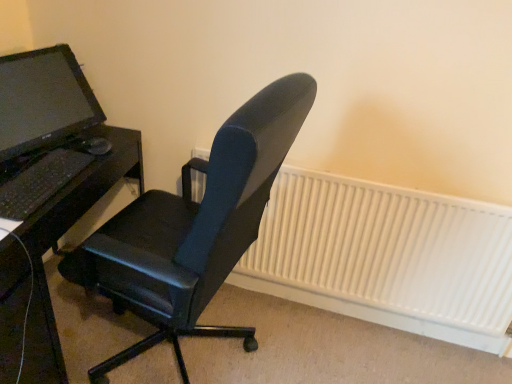
Question: From their relative heights in the image, would you say white matte radiator at center is taller or shorter than black matte desk at left?

Choices:
 (A) short
 (B) tall

Answer: (A)

Question: Is point (332, 220) positioned closer to the camera than point (50, 216)?

Choices:
 (A) closer
 (B) farther

Answer: (A)

Question: Estimate the real-world distances between objects in this image. Which object is closer to the black plastic mouse at center?

Choices:
 (A) black matte desk at left
 (B) black matte keyboard at left
 (C) black leather office chair at center
 (D) matte black monitor at left
 (E) white matte radiator at center

Answer: (D)

Question: Considering the real-world distances, which object is closest to the black matte desk at left?

Choices:
 (A) matte black monitor at left
 (B) black matte keyboard at left
 (C) black plastic mouse at center
 (D) black leather office chair at center
 (E) white matte radiator at center

Answer: (B)